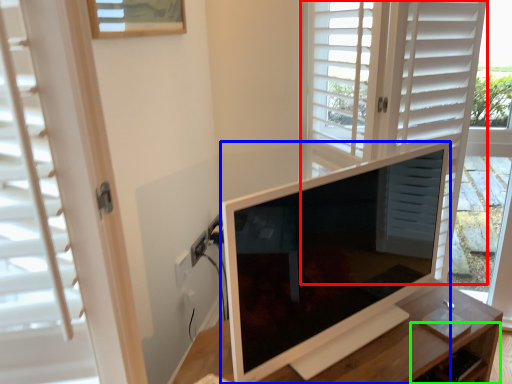
Question: Based on their relative distances, which object is nearer to screen door (highlighted by a red box)? Choose from television (highlighted by a blue box) and drawer (highlighted by a green box).

Choices:
 (A) television
 (B) drawer

Answer: (A)